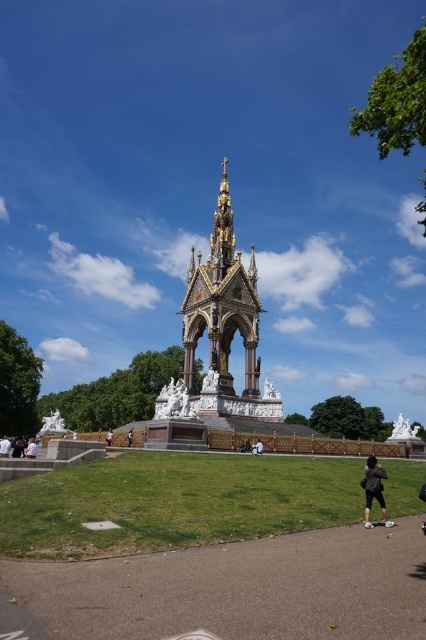
Consider the image. You are standing on the paved walkway in front of the Albert Memorial. You see a white marble statues at center and a white fabric person at center. Which object is closer to you?

The white marble statues at center is closer to the viewer than the white fabric person at center.

In the scene shown: You are standing on the paved walkway in front of the monument and see the white marble statues at center and the white fabric person at center. Which object is located to the left of the other?

The white marble statues at center is positioned on the left side of white fabric person at center.